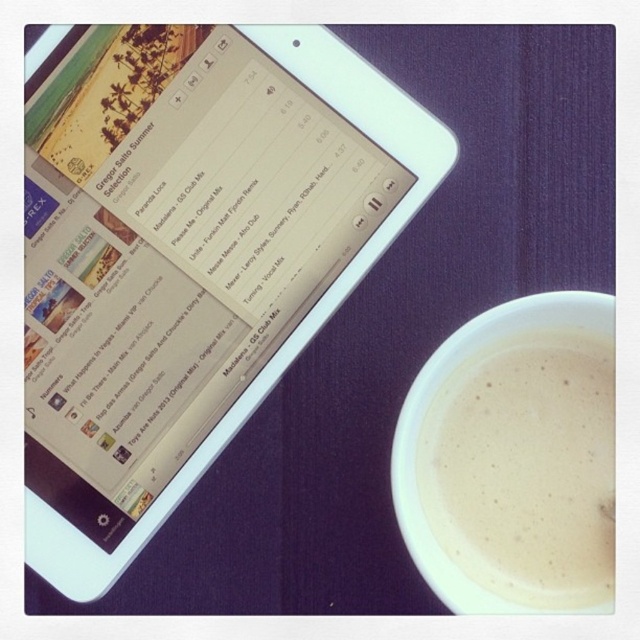
You are a barista who just prepared a white frothy coffee at lower right. Now you need to place it on the dark purple surface next to the tablet. However, there is a small warning label on the tablet that says,

The white frothy coffee at lower right should be placed away from the tablet to avoid potential damage from spills or heat. The warning label likely advises against placing hot beverages near electronic devices to prevent liquid damage.

You are a barista who needs to place a new coffee order on the counter. The customer requested the coffee to be placed exactly 5 inches away from their tablet. Given the current setup with the white frothy coffee at lower right and the white glossy tablet at upper left, can you fulfill this request without moving either object?

The white frothy coffee at lower right is 5.07 inches away from the white glossy tablet at upper left, so yes, the barista can fulfill the request since the distance is already approximately 5 inches.

You are organizing a small desk and have a white frothy coffee at lower right and a white glossy tablet at upper left. Given their sizes, which item takes up more space on the desk?

The white glossy tablet at upper left takes up more space on the desk than the white frothy coffee at lower right because the white frothy coffee at lower right occupies less space than the white glossy tablet at upper left.